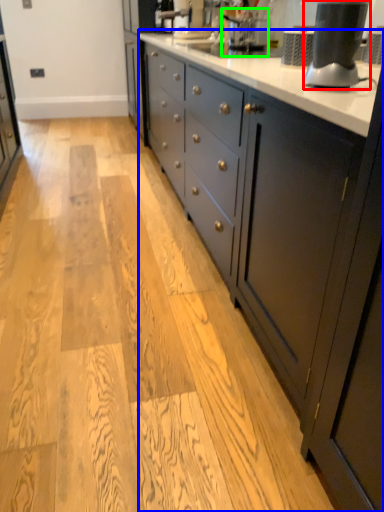
Question: Considering the real-world distances, which object is farthest from home appliance (highlighted by a red box)? countertop (highlighted by a blue box) or coffee machine (highlighted by a green box)?

Choices:
 (A) countertop
 (B) coffee machine

Answer: (B)